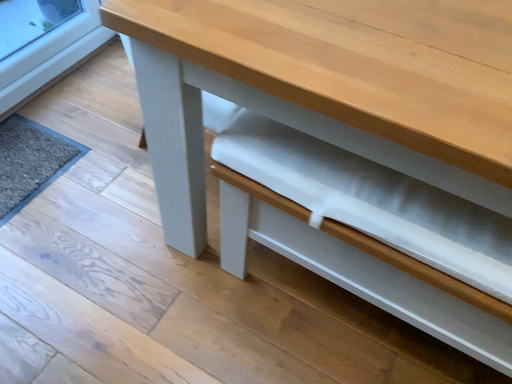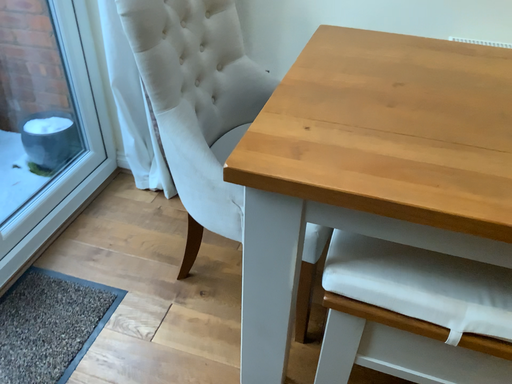
Question: How did the camera likely rotate when shooting the video?

Choices:
 (A) rotated right
 (B) rotated left

Answer: (A)